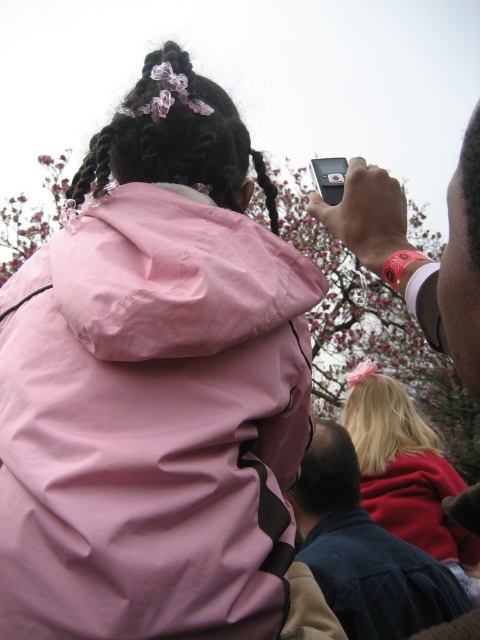
Question: Is pink fabric braids at upper center to the left of silky black hair at upper center from the viewer's perspective?

Choices:
 (A) yes
 (B) no

Answer: (A)

Question: Is blue denim jacket at lower right to the right of matte black phone at upper right from the viewer's perspective?

Choices:
 (A) yes
 (B) no

Answer: (A)

Question: Which object is positioned closest to the pink fabric braids at upper center?

Choices:
 (A) blue denim jacket at lower right
 (B) matte pink hoodie at upper right
 (C) matte black phone at upper right
 (D) silky black hair at upper center

Answer: (D)

Question: Among these objects, which one is nearest to the camera?

Choices:
 (A) matte black phone at upper right
 (B) pink matte jacket at upper left

Answer: (A)

Question: Does blue denim jacket at lower right appear on the left side of matte pink hoodie at upper right?

Choices:
 (A) yes
 (B) no

Answer: (A)

Question: Which object is farther from the camera taking this photo?

Choices:
 (A) blue denim jacket at lower right
 (B) silky black hair at upper center
 (C) pink fabric braids at upper center
 (D) matte black phone at upper right

Answer: (A)